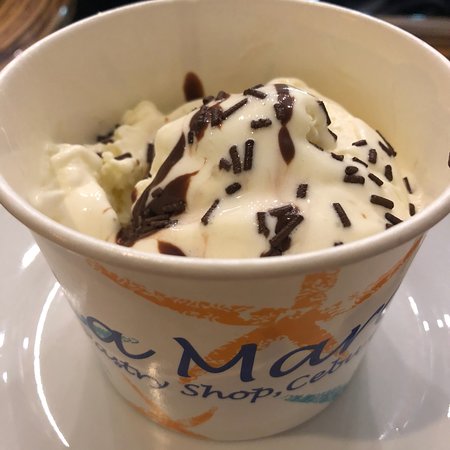
You are a GUI agent. You are given a task and a screenshot of the screen. Output one action in this format:
    pyautogui.click(x=<x>, y=<y>)
    Task: Click on the saucer or plate
    
    Given the screenshot: What is the action you would take?
    pyautogui.click(x=78, y=407)